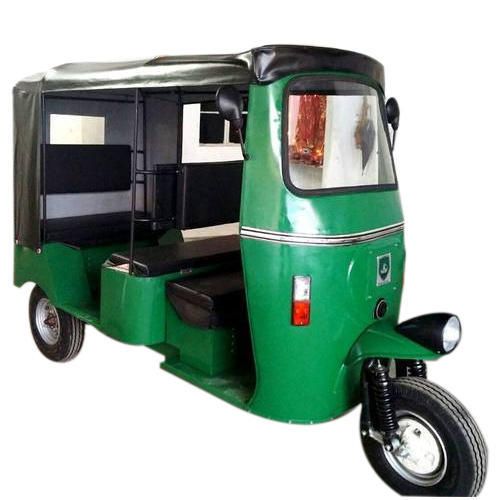
Identify the location of middle seat. (156, 257).